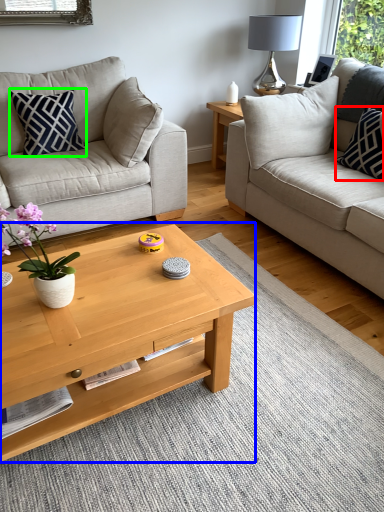
Question: Estimate the real-world distances between objects in this image. Which object is closer to pillow (highlighted by a red box), coffee table (highlighted by a blue box) or pillow (highlighted by a green box)?

Choices:
 (A) coffee table
 (B) pillow

Answer: (A)